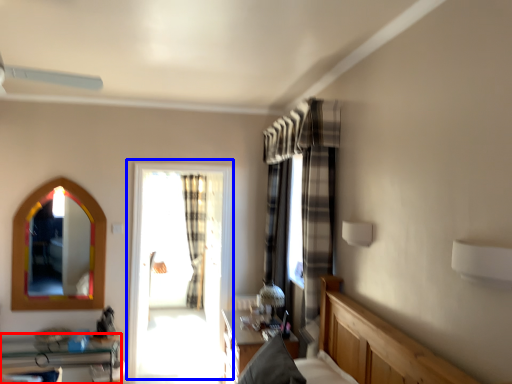
Question: Among these objects, which one is farthest to the camera, furniture (highlighted by a red box) or window (highlighted by a blue box)?

Choices:
 (A) furniture
 (B) window

Answer: (B)